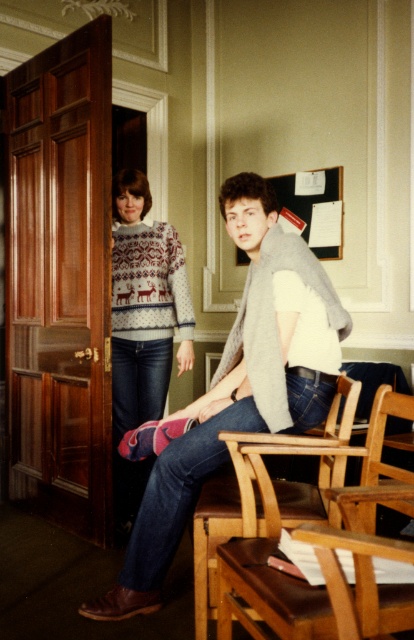
You are organizing a winter themed party and need to place the white knit sweater with reindeer pattern at left and the brown leather chair at lower center in a specific arrangement. According to the scene, which object is positioned to the left of the other?

The white knit sweater with reindeer pattern at left is to the left of the brown leather chair at lower center.

You are standing in the study room and want to move from the wooden door to the person sitting on the chair. The coordinates of the door are point (x=336, y=483) and the chair is at point (x=255, y=202). Is the chair located behind the door or in front of it?

Point (x=255, y=202) is behind point (x=336, y=483), so the chair is located behind the door.